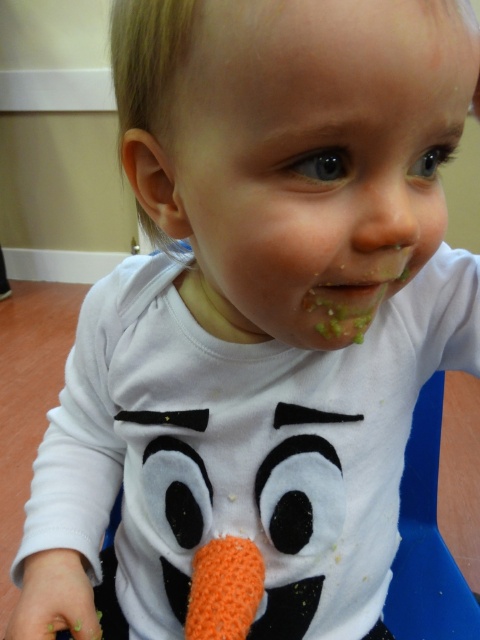
Question: Can you confirm if smooth white face at center is thinner than orange knitted carrot at lower center?

Choices:
 (A) yes
 (B) no

Answer: (B)

Question: Does smooth white face at center appear on the left side of orange knitted carrot at lower center?

Choices:
 (A) yes
 (B) no

Answer: (B)

Question: Which of the following is the farthest from the observer?

Choices:
 (A) smooth white face at center
 (B) orange knitted carrot at lower center

Answer: (B)

Question: Which point is farther from the camera taking this photo?

Choices:
 (A) (231, 632)
 (B) (251, 132)

Answer: (A)

Question: Can you confirm if smooth white face at center is positioned below orange knitted carrot at lower center?

Choices:
 (A) no
 (B) yes

Answer: (A)